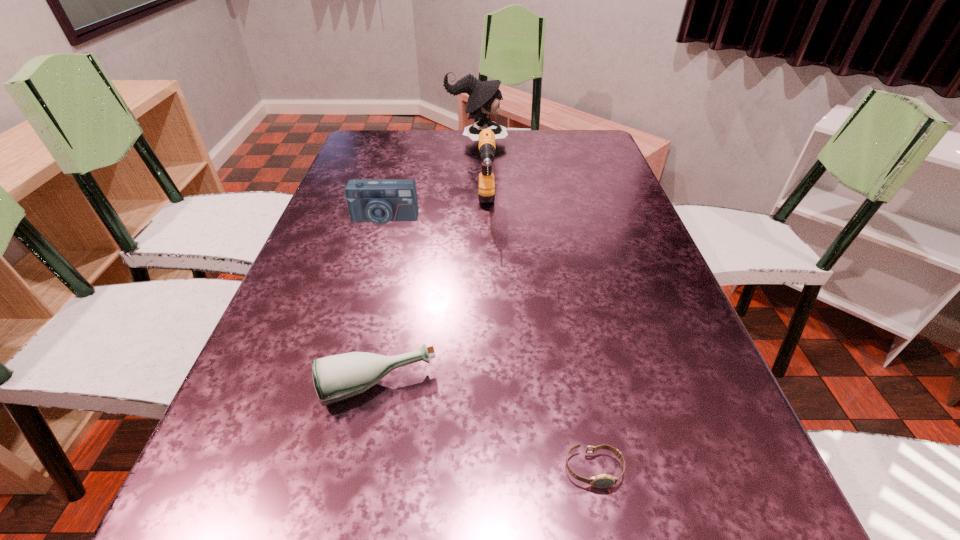
Find the location of a particular element. blank space located on the lens of the camera is located at coordinates (365, 286).

This screenshot has height=540, width=960. In order to click on vacant space located on the front of the bottle in this screenshot , I will do `click(363, 457)`.

Locate an element on the screen. This screenshot has height=540, width=960. vacant space located on the face of the nearest object is located at coordinates (606, 535).

Locate an element on the screen. The image size is (960, 540). object at the far edge is located at coordinates click(x=484, y=99).

Identify the location of camera present at the left edge. The width and height of the screenshot is (960, 540). (379, 201).

Find the location of a particular element. bottle present at the left edge is located at coordinates (338, 377).

Image resolution: width=960 pixels, height=540 pixels. In order to click on free space at the far edge in this screenshot , I will do `click(413, 157)`.

I want to click on free space at the near edge of the desktop, so tap(471, 534).

Where is `free spot at the left edge of the desktop`? This screenshot has height=540, width=960. free spot at the left edge of the desktop is located at coordinates (326, 302).

I want to click on vacant region at the right edge of the desktop, so click(x=620, y=200).